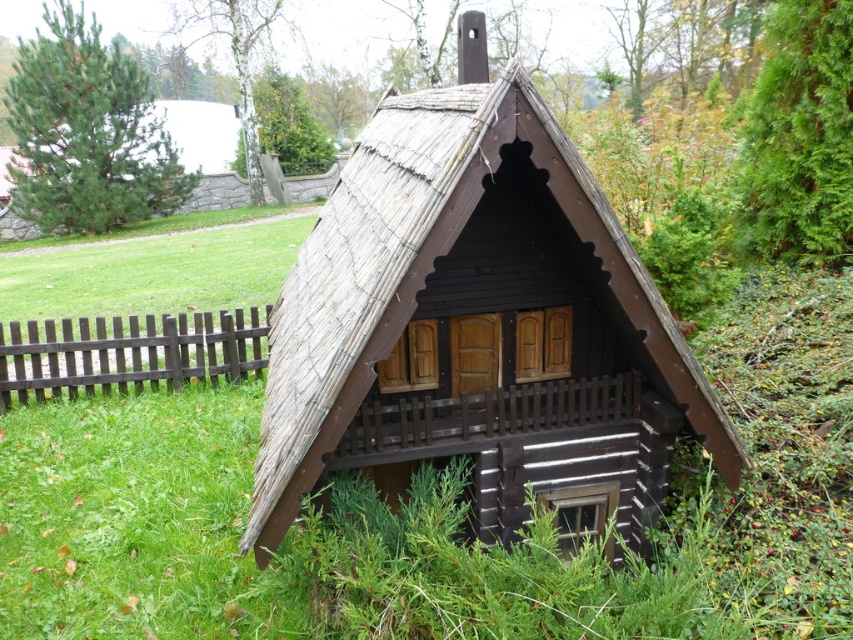
Who is shorter, matte black cabin at center or brown wooden fence at lower left?

brown wooden fence at lower left

The width and height of the screenshot is (853, 640). What do you see at coordinates (476, 321) in the screenshot? I see `matte black cabin at center` at bounding box center [476, 321].

Locate an element on the screen. The width and height of the screenshot is (853, 640). matte black cabin at center is located at coordinates (476, 321).

Who is taller, green grass at center or brown wooden fence at lower left?

green grass at center is taller.

Is point (20, 276) positioned before point (154, 368)?

No, (20, 276) is further to viewer.

Identify the location of green grass at center. (135, 518).

Is point (457, 429) farther from viewer compared to point (62, 620)?

No.

Is matte black cabin at center thinner than green grass at center?

Correct, matte black cabin at center's width is less than green grass at center's.

Does point (463, 289) lie in front of point (173, 419)?

Yes, point (463, 289) is closer to viewer.

At what (x,y) coordinates should I click in order to perform the action: click on matte black cabin at center. Please return your answer as a coordinate pair (x, y). The width and height of the screenshot is (853, 640). Looking at the image, I should click on (476, 321).